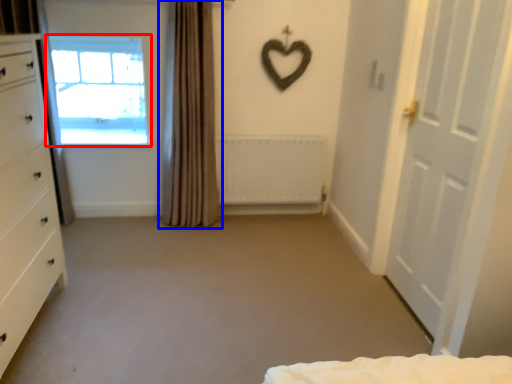
Question: Which of the following is the closest to the observer, window (highlighted by a red box) or curtain (highlighted by a blue box)?

Choices:
 (A) window
 (B) curtain

Answer: (B)